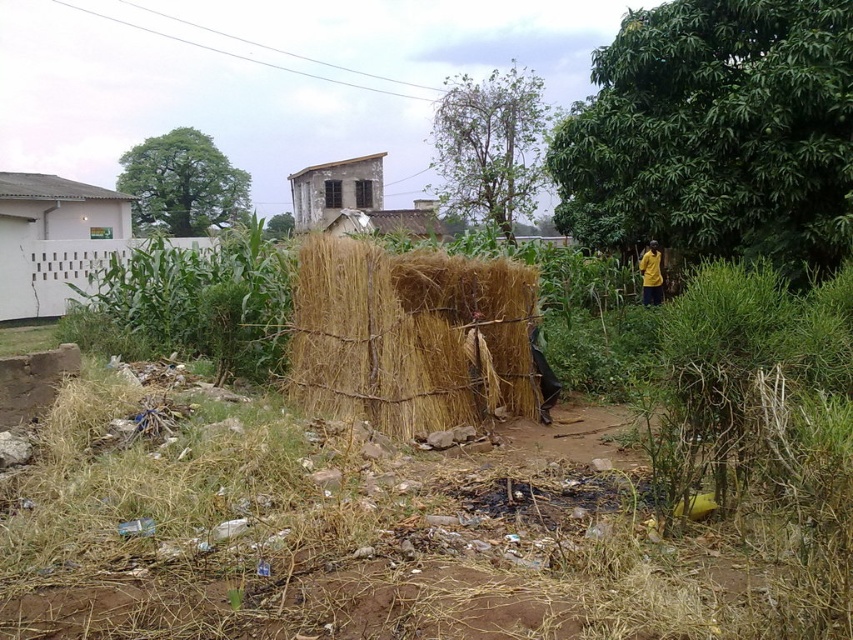
Is point (79, 262) positioned in front of point (349, 228)?

Yes.

Identify the location of white lattice fence at upper left. The image size is (853, 640). (53, 240).

From the picture: Can you confirm if dry straw bale at center is bigger than weathered wooden hut at center?

No, dry straw bale at center is not bigger than weathered wooden hut at center.

Who is more distant from viewer, (x=448, y=388) or (x=311, y=212)?

Positioned behind is point (x=311, y=212).

Which is in front, point (390, 289) or point (421, 225)?

Positioned in front is point (390, 289).

This screenshot has height=640, width=853. I want to click on dry straw bale at center, so click(409, 337).

Does dry straw bale at center have a greater height compared to white lattice fence at upper left?

Incorrect, dry straw bale at center's height is not larger of white lattice fence at upper left's.

Describe the element at coordinates (409, 337) in the screenshot. I see `dry straw bale at center` at that location.

Identify the location of dry straw bale at center. (409, 337).